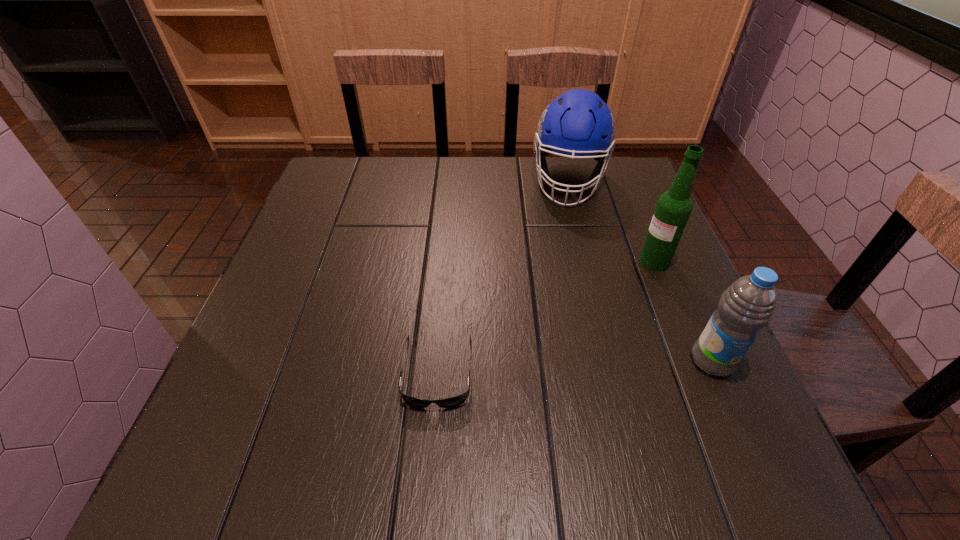
You are a GUI agent. You are given a task and a screenshot of the screen. Output one action in this format:
    pyautogui.click(x=<x>, y=<y>)
    Task: Click on the object that is positioned at the near right corner
    
    Given the screenshot: What is the action you would take?
    pyautogui.click(x=748, y=305)

The width and height of the screenshot is (960, 540). What are the coordinates of `vacant space at the far edge of the desktop` in the screenshot? It's located at (519, 164).

The height and width of the screenshot is (540, 960). In the image, there is a desktop. Find the location of `free space at the near edge`. free space at the near edge is located at coordinates (548, 417).

This screenshot has height=540, width=960. What are the coordinates of `vacant space at the left edge of the desktop` in the screenshot? It's located at (321, 269).

The width and height of the screenshot is (960, 540). I want to click on free space at the right edge of the desktop, so click(619, 223).

Find the location of `vacant region at the near right corner of the desktop`. vacant region at the near right corner of the desktop is located at coordinates (658, 392).

The height and width of the screenshot is (540, 960). What are the coordinates of `vacant region between the second object from left to right and the water bottle` in the screenshot? It's located at (640, 271).

Where is `blank region between the beer bottle and the second object from left to right`? blank region between the beer bottle and the second object from left to right is located at coordinates (612, 221).

The height and width of the screenshot is (540, 960). Find the location of `free space between the football helmet and the third nearest object`. free space between the football helmet and the third nearest object is located at coordinates (612, 221).

I want to click on free space between the sunglasses and the water bottle, so click(575, 366).